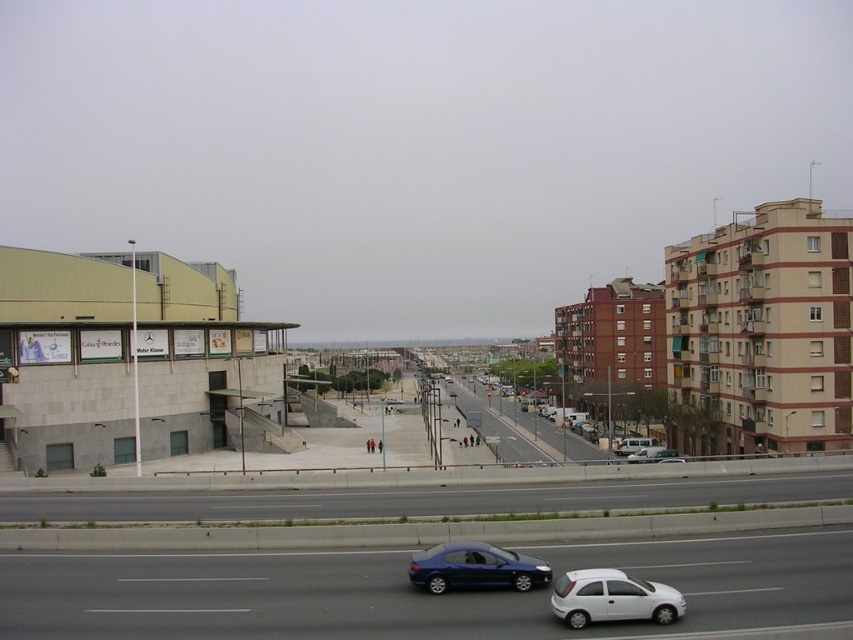
Question: Among these points, which one is farthest from the camera?

Choices:
 (A) (543, 561)
 (B) (633, 444)
 (C) (613, 573)

Answer: (B)

Question: Estimate the real-world distances between objects in this image. Which object is closer to the white matte van at center?

Choices:
 (A) asphalt road at lower center
 (B) white glossy hatchback at lower center
 (C) matte blue sedan at center

Answer: (A)

Question: Estimate the real-world distances between objects in this image. Which object is closer to the white matte van at center?

Choices:
 (A) white glossy hatchback at lower center
 (B) asphalt road at lower center
 (C) matte blue sedan at center

Answer: (B)

Question: Can you confirm if asphalt road at lower center is thinner than white matte van at center?

Choices:
 (A) no
 (B) yes

Answer: (A)

Question: Does asphalt road at lower center have a smaller size compared to matte blue sedan at center?

Choices:
 (A) no
 (B) yes

Answer: (A)

Question: Does white glossy hatchback at lower center have a lesser width compared to white matte van at center?

Choices:
 (A) yes
 (B) no

Answer: (A)